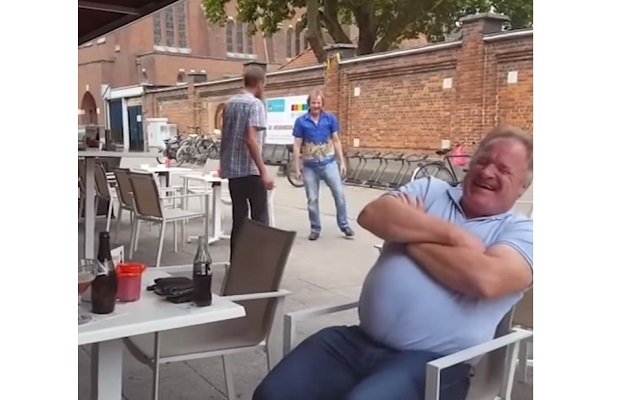
The image size is (620, 400). I want to click on table, so click(146, 309), click(196, 175).